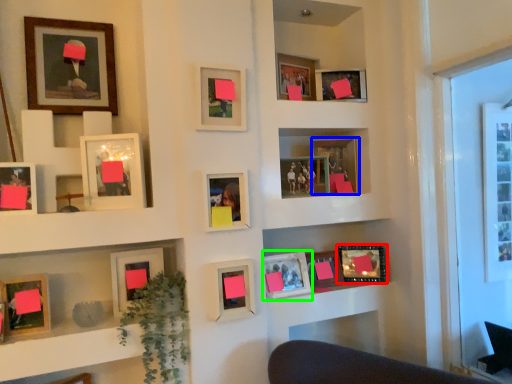
Question: Which is farther away from picture frame (highlighted by a red box)? picture frame (highlighted by a blue box) or picture frame (highlighted by a green box)?

Choices:
 (A) picture frame
 (B) picture frame

Answer: (A)